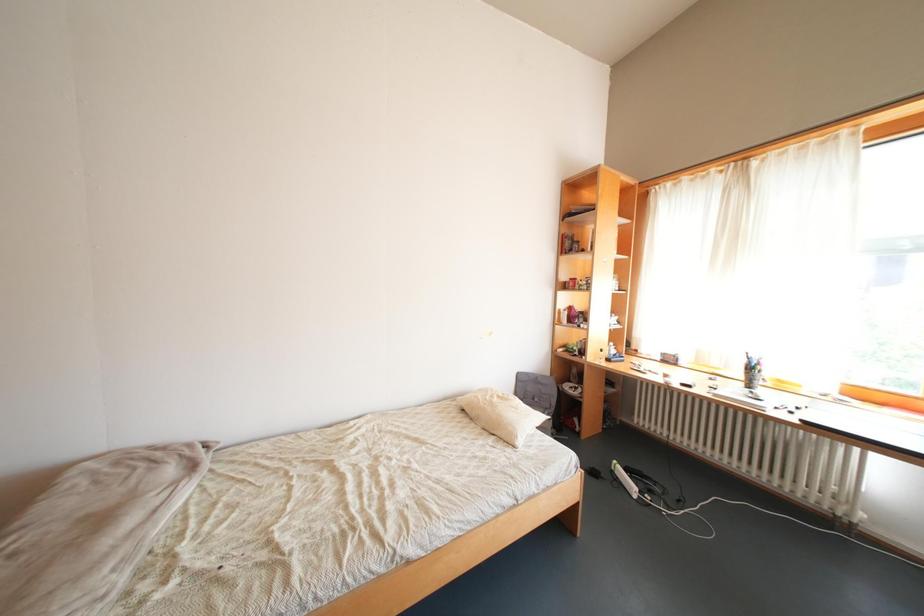
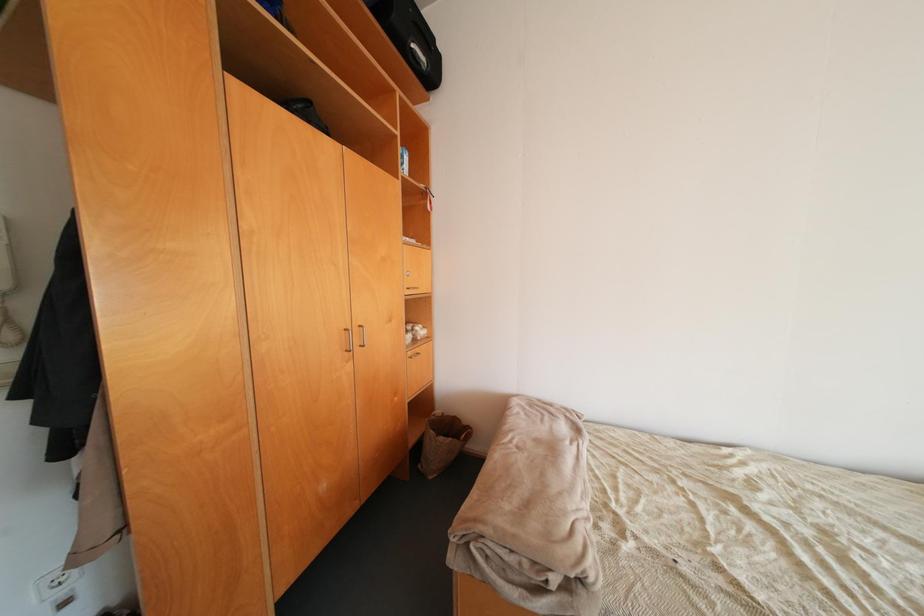
Question: The images are taken continuously from a first-person perspective. In which direction is your viewpoint rotating?

Choices:
 (A) Left
 (B) Right
 (C) Up
 (D) Down

Answer: (A)